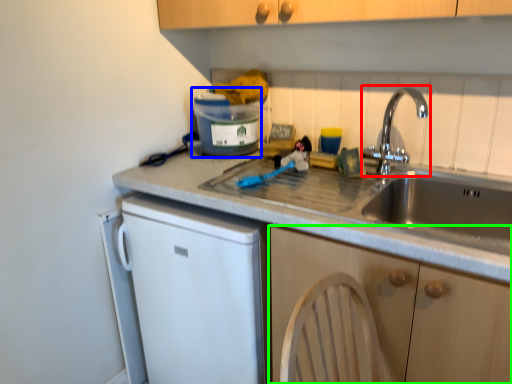
Question: Which object is positioned closest to tap (highlighted by a red box)? Select from appliance (highlighted by a blue box) and cabinetry (highlighted by a green box).

Choices:
 (A) appliance
 (B) cabinetry

Answer: (A)